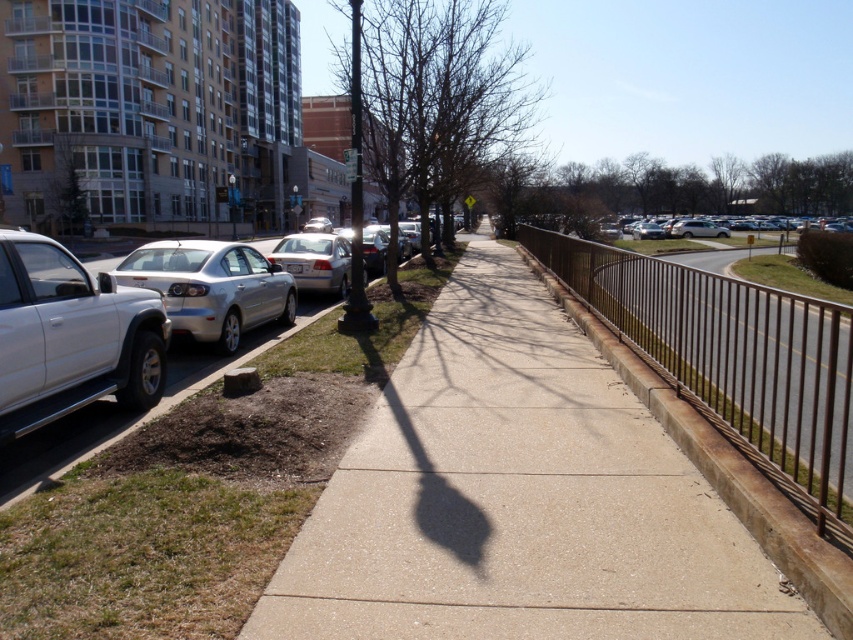
You are a delivery person trying to navigate a narrow alley between the brown metal fence at right and the satin silver sedan at left. Can you pass through the space between them?

The brown metal fence at right is bigger than the satin silver sedan at left, so the space between them might be too narrow for a delivery person to pass through safely. You should check the width before attempting to navigate.

In the scene shown: You are a delivery person trying to park your van between the satin silver sedan at left and the silver metallic sedan at right on the sidewalk. Can you fit your van, which is 2 meters wide, in the space between them?

The satin silver sedan at left occupies less space than silver metallic sedan at right, so the space between them may be sufficient for your van. However, without exact measurements of the gap, it is uncertain if the 2 meter wide van will fit.